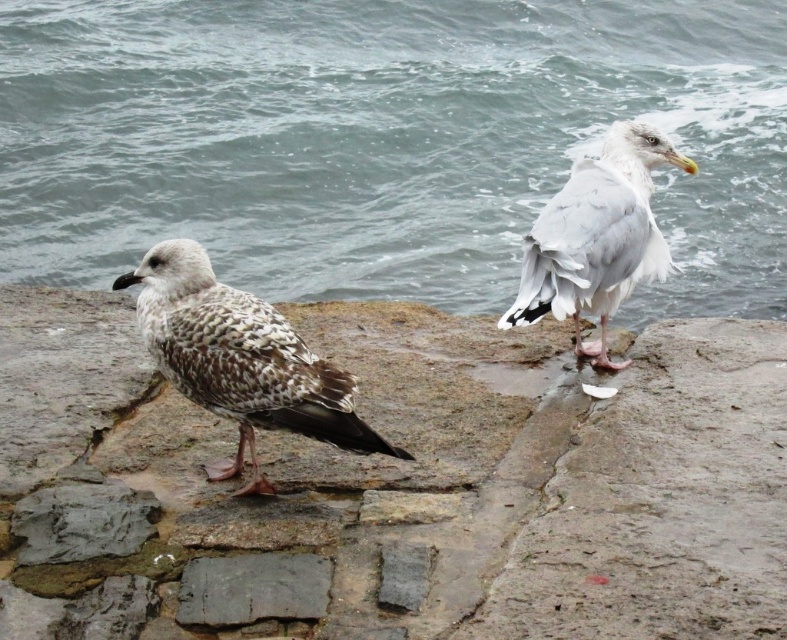
You are standing near the seagulls and want to pick up the rough stone at center and the smooth gray stone at center. Which stone should you reach for first to pick up the one closer to you?

The rough stone at center is closer to the viewer than the smooth gray stone at center, so you should reach for the rough stone at center first.

You are a birdwatcher observing the scene. You notice the white feathered bird at upper right and the smooth gray stone at center. Which object takes up more horizontal space in the image?

The white feathered bird at upper right takes up more horizontal space in the image because its width is larger than the smooth gray stone at center.

You are a birdwatcher observing the scene. You notice the gray water at center and the speckled feathered seagull at left. Which object takes up more space in the image?

The gray water at center has a larger size compared to the speckled feathered seagull at left, so it occupies more space in the image.